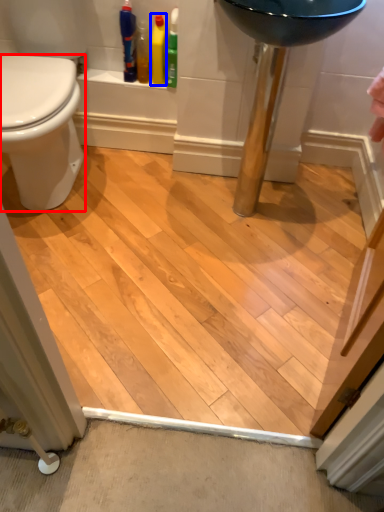
Question: Which point is closer to the camera, bidet (highlighted by a red box) or cleaning product (highlighted by a blue box)?

Choices:
 (A) bidet
 (B) cleaning product

Answer: (A)